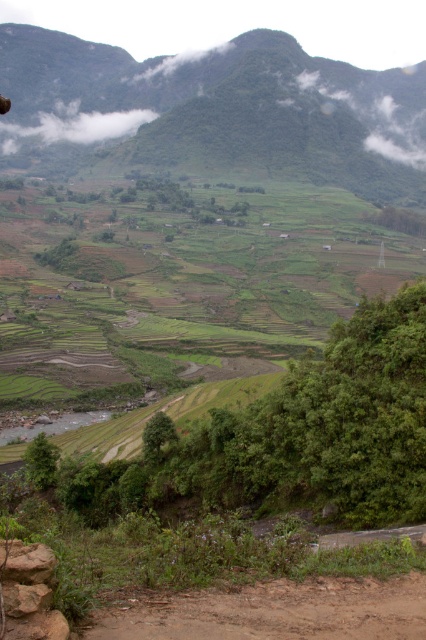
From the picture: You are a hiker planning to walk along the brown dirt track at lower center and the green grassy mountain at upper center. Which of these two has a greater width?

The green grassy mountain at upper center has a greater width than the brown dirt track at lower center.

You are hiking and want to reach the green grassy mountain at upper center. You see the brown dirt track at lower center ahead. Which direction should you turn to head towards the mountain?

To reach the green grassy mountain at upper center, you should turn left since it is positioned on the left side of the brown dirt track at lower center.

You are hiking and want to reach the brown dirt track at lower center. Which direction should you head towards from the green grassy mountain at upper center?

You should head downward towards the brown dirt track at lower center because the green grassy mountain at upper center is further away from you, meaning the track is lower in elevation.